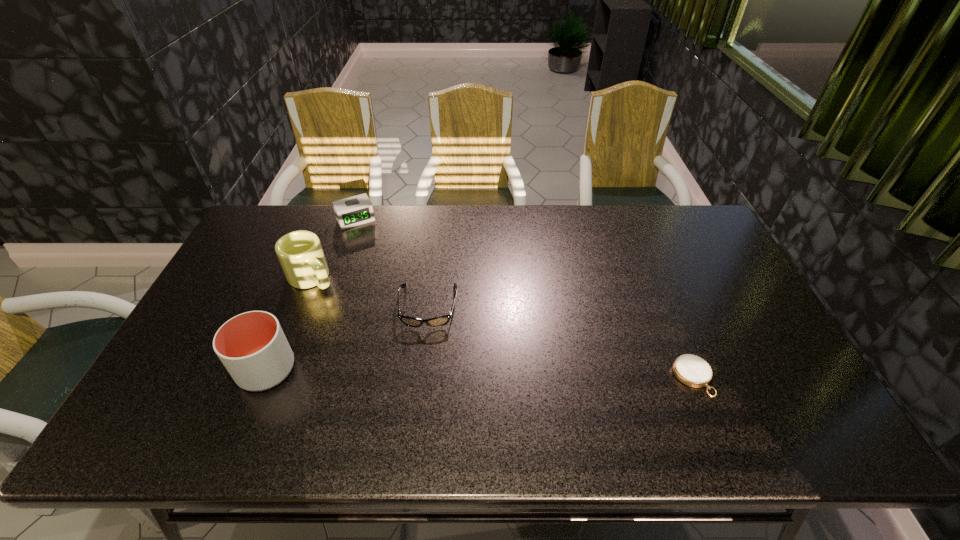
Where is `vacant area that lies between the mug and the cup`? Image resolution: width=960 pixels, height=540 pixels. vacant area that lies between the mug and the cup is located at coordinates (289, 323).

This screenshot has height=540, width=960. I want to click on empty space that is in between the spectacles and the cup, so click(348, 338).

The width and height of the screenshot is (960, 540). Find the location of `free spot between the third shortest object and the second shortest object`. free spot between the third shortest object and the second shortest object is located at coordinates (392, 264).

Where is `free space that is in between the cup and the shortest object`? The image size is (960, 540). free space that is in between the cup and the shortest object is located at coordinates (480, 373).

Locate an element on the screen. The width and height of the screenshot is (960, 540). free spot between the spectacles and the mug is located at coordinates point(370,292).

At what (x,y) coordinates should I click in order to perform the action: click on vacant region between the cup and the mug. Please return your answer as a coordinate pair (x, y). Image resolution: width=960 pixels, height=540 pixels. Looking at the image, I should click on (289, 323).

Locate an element on the screen. the third closest object to the fourth object from left to right is located at coordinates (356, 210).

Select which object appears as the closest to the second object from right to left. Please provide its 2D coordinates. Your answer should be formatted as a tuple, i.e. [(x, y)], where the tuple contains the x and y coordinates of a point satisfying the conditions above.

[(300, 253)]

What are the coordinates of `vacant area that satisfies the following two spatial constraints: 1. on the back side of the farthest object; 2. on the left side of the mug` in the screenshot? It's located at [334, 220].

Find the location of a particular element. The image size is (960, 540). vacant space that satisfies the following two spatial constraints: 1. on the front side of the fourth object from left to right; 2. on the right side of the alarm clock is located at coordinates (326, 307).